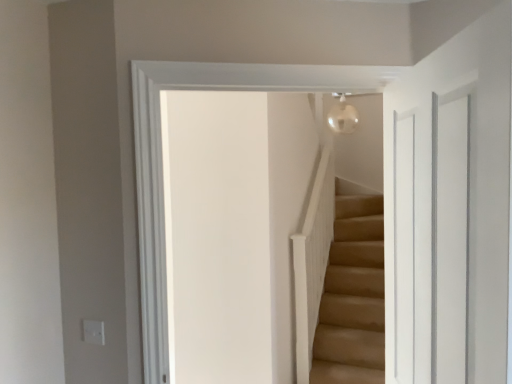
Question: Which is correct: white matte balustrade at upper center is inside transparent glass door at right, or outside of it?

Choices:
 (A) inside
 (B) outside

Answer: (B)

Question: Considering their positions, is white matte balustrade at upper center located in front of or behind transparent glass door at right?

Choices:
 (A) front
 (B) behind

Answer: (B)

Question: From a real-world perspective, is white matte balustrade at upper center above or below transparent glass door at right?

Choices:
 (A) below
 (B) above

Answer: (A)

Question: Considering their positions, is transparent glass door at right located in front of or behind white matte balustrade at upper center?

Choices:
 (A) front
 (B) behind

Answer: (A)

Question: In terms of height, does transparent glass door at right look taller or shorter compared to white matte balustrade at upper center?

Choices:
 (A) short
 (B) tall

Answer: (A)

Question: Is transparent glass door at right spatially inside white matte balustrade at upper center, or outside of it?

Choices:
 (A) inside
 (B) outside

Answer: (B)

Question: From a real-world perspective, is transparent glass door at right physically located above or below white matte balustrade at upper center?

Choices:
 (A) above
 (B) below

Answer: (A)